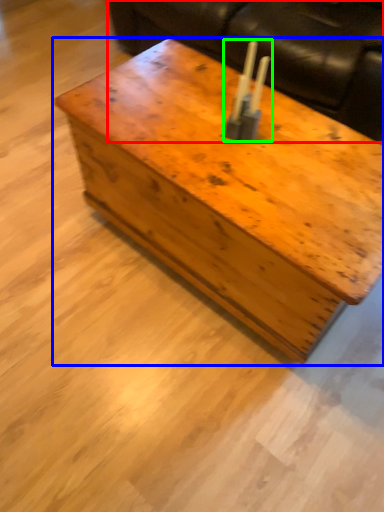
Question: Based on their relative distances, which object is nearer to couch (highlighted by a red box)? Choose from table (highlighted by a blue box) and candle holder (highlighted by a green box).

Choices:
 (A) table
 (B) candle holder

Answer: (A)